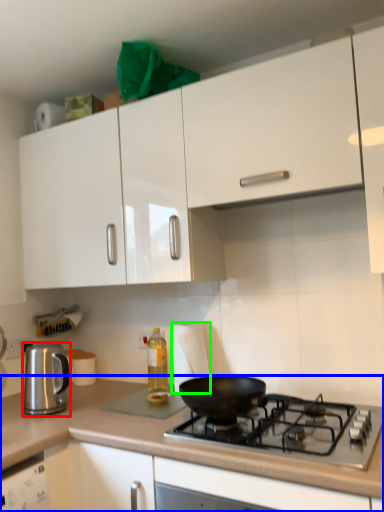
Question: Which object is the farthest from kitchen appliance (highlighted by a red box)? Choose among these: countertop (highlighted by a blue box) or paper towel (highlighted by a green box).

Choices:
 (A) countertop
 (B) paper towel

Answer: (B)